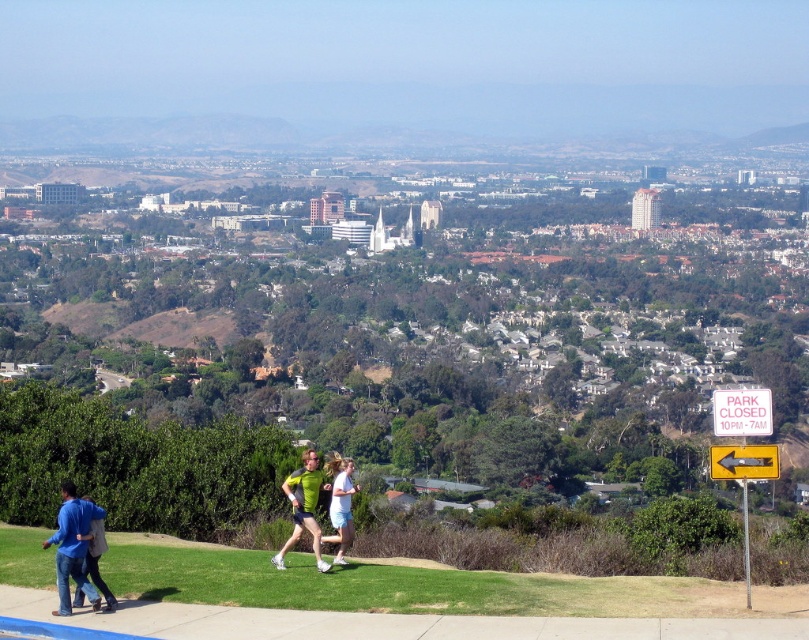
You are a fashion designer observing the scene. You need to determine which clothing item has a smaller width between the light blue denim shorts at center and the blue cotton jacket at lower left. Which one is narrower?

The light blue denim shorts at center has a smaller width compared to the blue cotton jacket at lower left, making it narrower.

You are standing in the park and see the light blue denim shorts at center and the blue cotton jacket at lower left. Which item is closer to you?

The light blue denim shorts at center is closer to you because it is further to the viewer than the blue cotton jacket at lower left.

You are standing at the vantage point looking at the scene. There is a blue denim jacket at lower left represented by point (71, 547). What is the position of the blue denim jacket at lower left relative to the two people jogging in the foreground?

The blue denim jacket at lower left is located at point (71, 547), which is to the left and slightly above the two people jogging in the foreground.